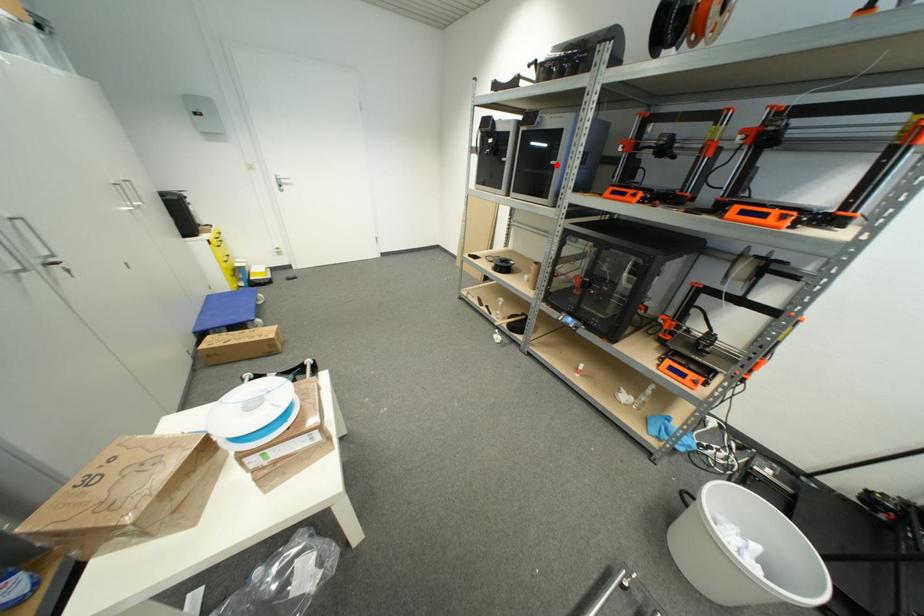
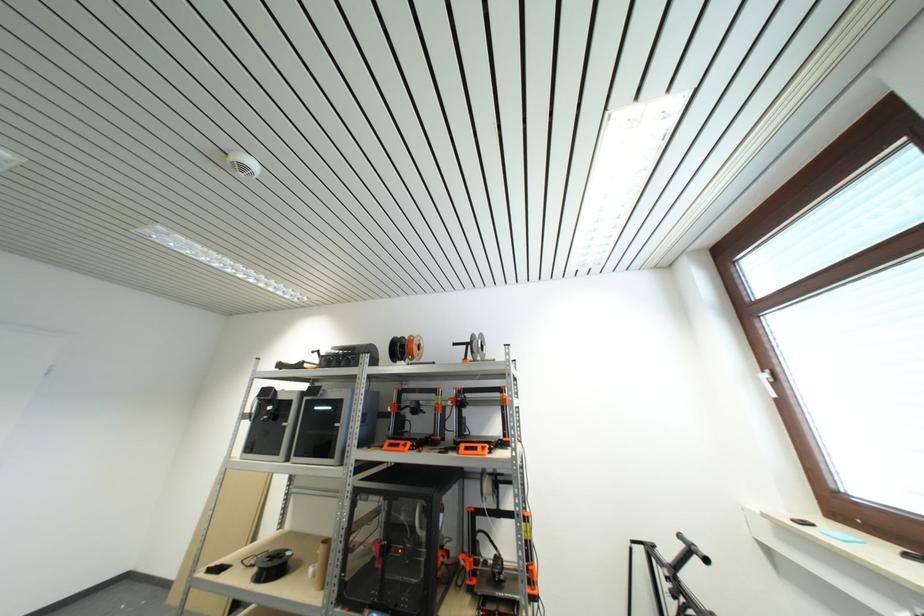
Question: A red point is marked in image1. In image2, is the corresponding 3D point closer to the camera or farther? Reply with the corresponding letter.

Choices:
 (A) The corresponding 3D point is closer.
 (B) The corresponding 3D point is farther.

Answer: (B)